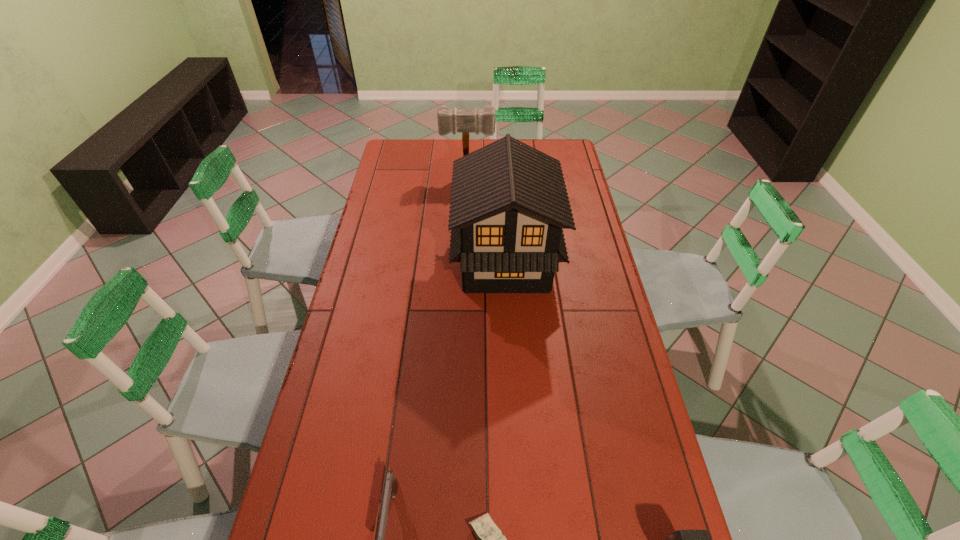
The width and height of the screenshot is (960, 540). What are the coordinates of `vacant area at the right edge` in the screenshot? It's located at (604, 360).

This screenshot has height=540, width=960. Identify the location of object that can be found as the third closest to the fourth shortest object. (489, 537).

Identify the location of the fourth closest object relative to the diary. (465, 121).